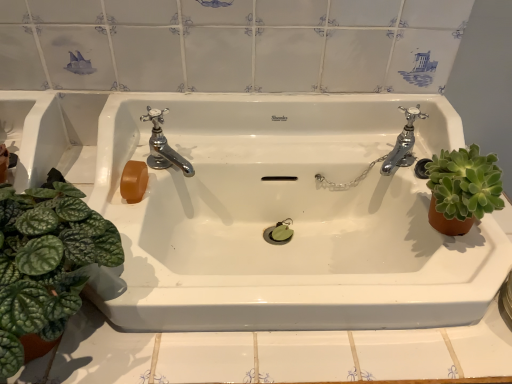
Question: Based on their sizes in the image, would you say chrome metallic faucet at upper left, marked as the second tap in a right-to-left arrangement, is bigger or smaller than green leafy plant at left, arranged as the 2th houseplant when viewed from the right?

Choices:
 (A) small
 (B) big

Answer: (A)

Question: From their relative heights in the image, would you say chrome metallic faucet at upper left, marked as the second tap in a right-to-left arrangement, is taller or shorter than green leafy plant at left, the 1th houseplant when ordered from left to right?

Choices:
 (A) tall
 (B) short

Answer: (B)

Question: Which of these objects is positioned farthest from the green succulent at right, placed as the second houseplant when sorted from left to right?

Choices:
 (A) chrome metallic faucet at upper left, arranged as the first tap when viewed from the left
 (B) green leafy plant at left, arranged as the 2th houseplant when viewed from the right
 (C) chrome metallic faucet at right, placed as the second tap when sorted from left to right
 (D) white glossy sink at center

Answer: (B)

Question: Which object is the closest to the white glossy sink at center?

Choices:
 (A) chrome metallic faucet at right, placed as the second tap when sorted from left to right
 (B) chrome metallic faucet at upper left, arranged as the first tap when viewed from the left
 (C) green leafy plant at left, arranged as the 2th houseplant when viewed from the right
 (D) green succulent at right, which is the first houseplant from right to left

Answer: (B)